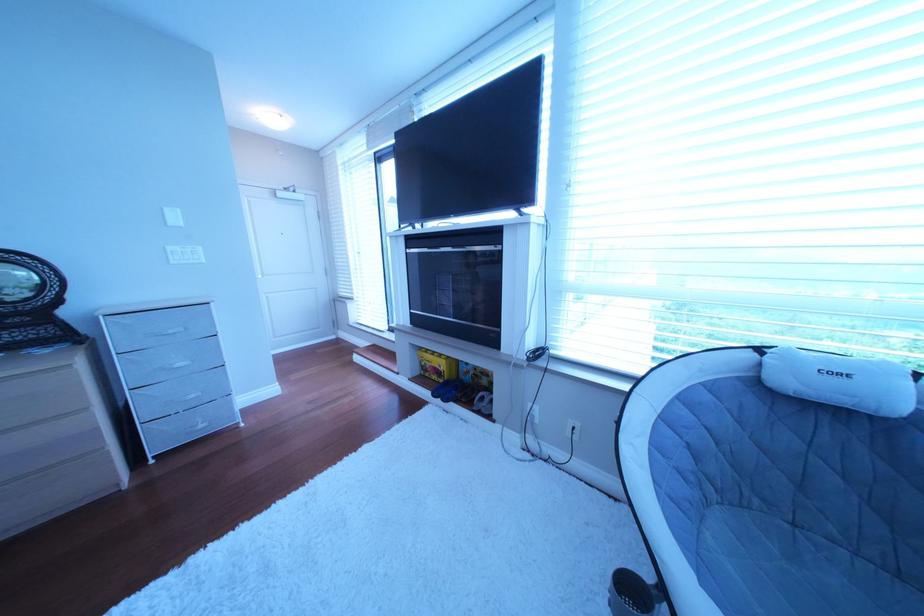
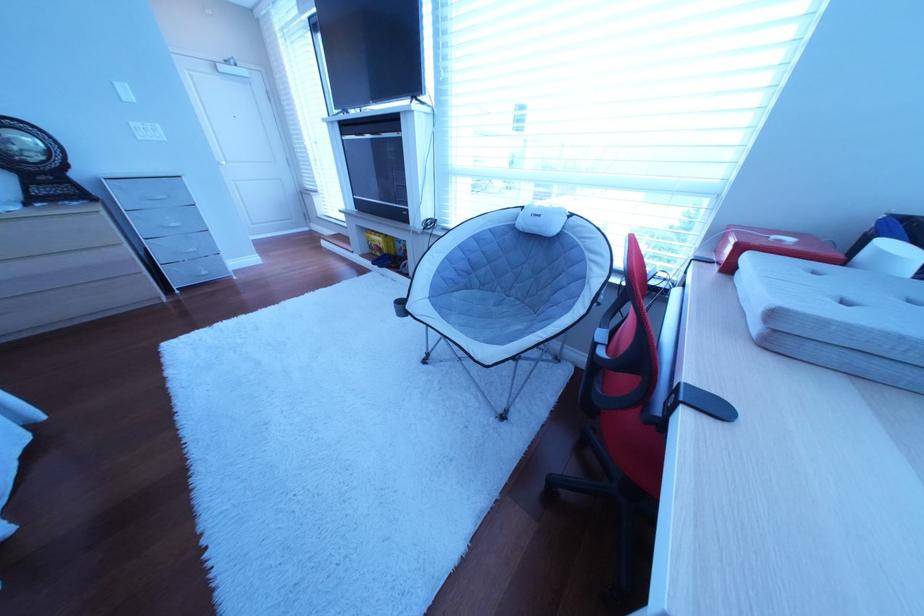
The point at (208, 398) is marked in the first image. Where is the corresponding point in the second image?

(207, 252)